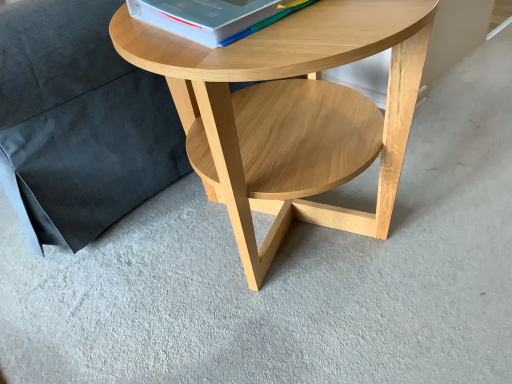
Question: Are white paper at upper center and natural wood coffee table at center making contact?

Choices:
 (A) yes
 (B) no

Answer: (B)

Question: Is white paper at upper center oriented towards natural wood coffee table at center?

Choices:
 (A) no
 (B) yes

Answer: (A)

Question: Is white paper at upper center wider than natural wood coffee table at center?

Choices:
 (A) no
 (B) yes

Answer: (A)

Question: Can you confirm if white paper at upper center is positioned to the right of natural wood coffee table at center?

Choices:
 (A) no
 (B) yes

Answer: (A)

Question: Is natural wood coffee table at center a part of white paper at upper center?

Choices:
 (A) yes
 (B) no

Answer: (B)

Question: Is white paper at upper center completely or partially outside of natural wood coffee table at center?

Choices:
 (A) yes
 (B) no

Answer: (A)

Question: Are white paper at upper center and black fabric pillow at upper left beside each other?

Choices:
 (A) yes
 (B) no

Answer: (B)

Question: Is white paper at upper center positioned before black fabric pillow at upper left?

Choices:
 (A) no
 (B) yes

Answer: (B)

Question: Does white paper at upper center have a greater width compared to black fabric pillow at upper left?

Choices:
 (A) no
 (B) yes

Answer: (A)

Question: From the image's perspective, does white paper at upper center appear higher than black fabric pillow at upper left?

Choices:
 (A) yes
 (B) no

Answer: (B)

Question: Considering the relative sizes of white paper at upper center and black fabric pillow at upper left in the image provided, is white paper at upper center shorter than black fabric pillow at upper left?

Choices:
 (A) yes
 (B) no

Answer: (A)

Question: Considering the relative sizes of white paper at upper center and black fabric pillow at upper left in the image provided, is white paper at upper center smaller than black fabric pillow at upper left?

Choices:
 (A) yes
 (B) no

Answer: (A)

Question: Are black fabric pillow at upper left and white paper at upper center located far from each other?

Choices:
 (A) no
 (B) yes

Answer: (A)